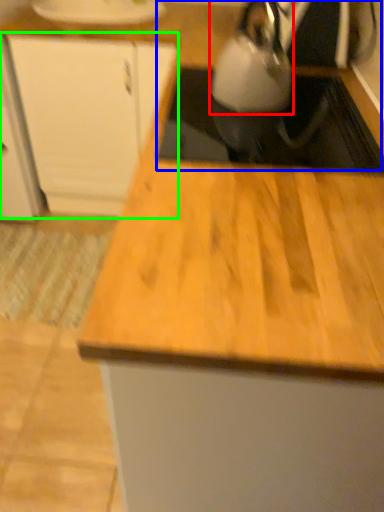
Question: Which object is positioned closest to kettle (highlighted by a red box)? Select from sink (highlighted by a blue box) and cabinetry (highlighted by a green box).

Choices:
 (A) sink
 (B) cabinetry

Answer: (A)